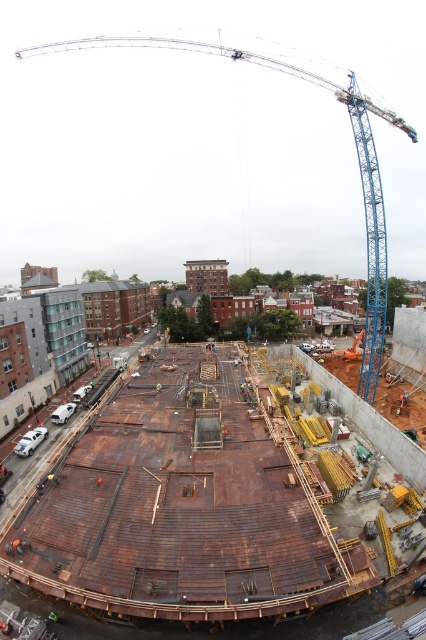
At what (x,y) coordinates should I click in order to perform the action: click on rusty wood construction site at center. Please return your answer as a coordinate pair (x, y). Looking at the image, I should click on (206, 500).

Does rusty wood construction site at center have a greater height compared to blue metallic crane at upper center?

Incorrect, rusty wood construction site at center's height is not larger of blue metallic crane at upper center's.

Between point (264, 609) and point (399, 128), which one is positioned behind?

Positioned behind is point (399, 128).

Identify the location of rusty wood construction site at center. (206, 500).